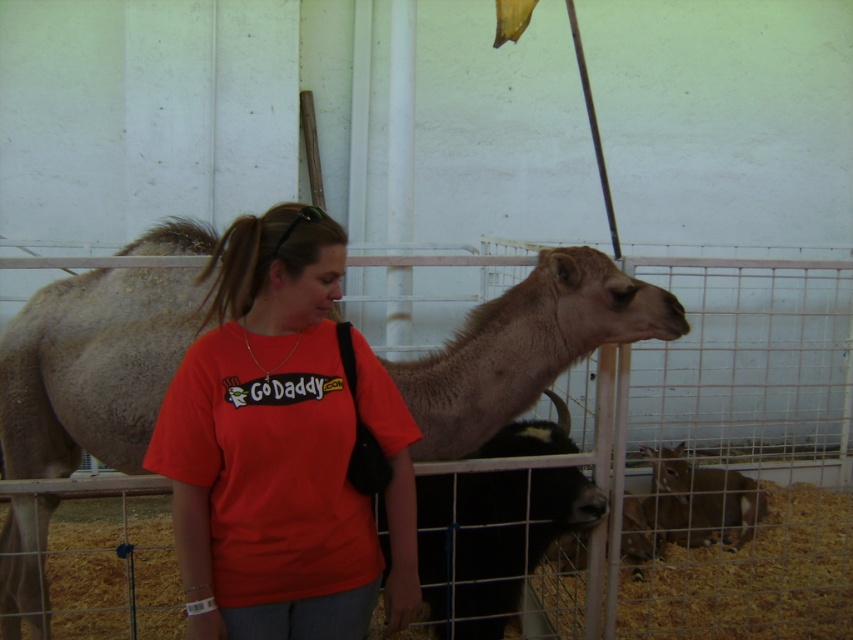
You are standing at the point with coordinates point (460, 598) and want to walk towards point (737, 524). According to the scene, will you be moving towards the camel or away from it?

Point (460, 598) is in front of point (737, 524). Since the camel is behind the woman, moving from point (460, 598) towards point (737, 524) would mean moving away from the camel.

Looking at this image, you are a visitor at the petting zoo and want to pet the animals. The light brown fur at center and the black woolly cow at center are both behind the fence. Which animal would you need to reach further to touch?

The light brown fur at center is bigger than the black woolly cow at center, so you would need to reach further to touch the light brown fur at center.